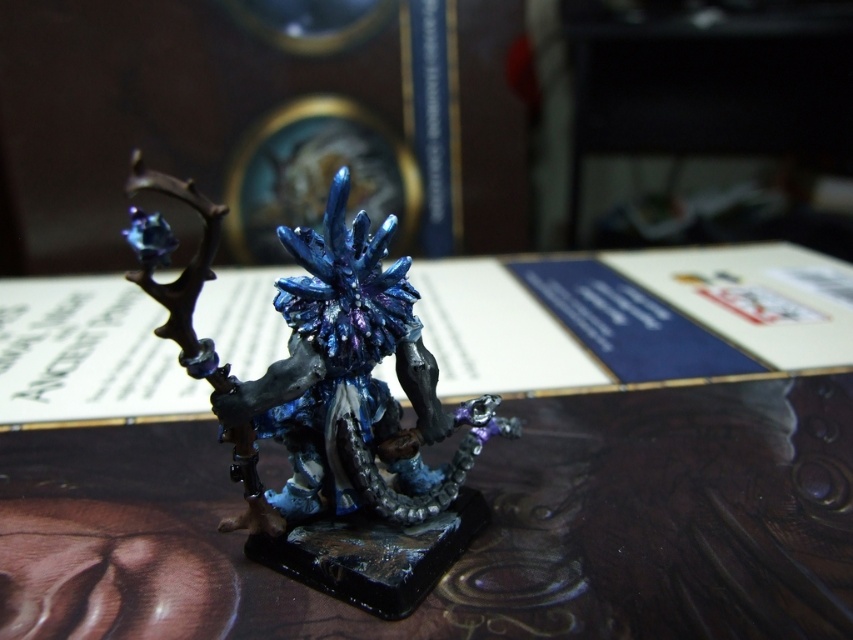
Is shiny brown table at center to the right of shiny metallic figure at center from the viewer's perspective?

Incorrect, shiny brown table at center is not on the right side of shiny metallic figure at center.

Is point (497, 616) closer to viewer compared to point (279, 371)?

No, (497, 616) is further to viewer.

Where is `shiny brown table at center`? Image resolution: width=853 pixels, height=640 pixels. shiny brown table at center is located at coordinates (469, 483).